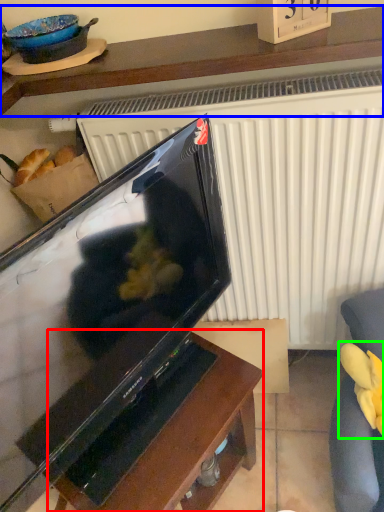
Question: Which object is the farthest from table (highlighted by a red box)? Choose among these: furniture (highlighted by a blue box) or food (highlighted by a green box).

Choices:
 (A) furniture
 (B) food

Answer: (A)